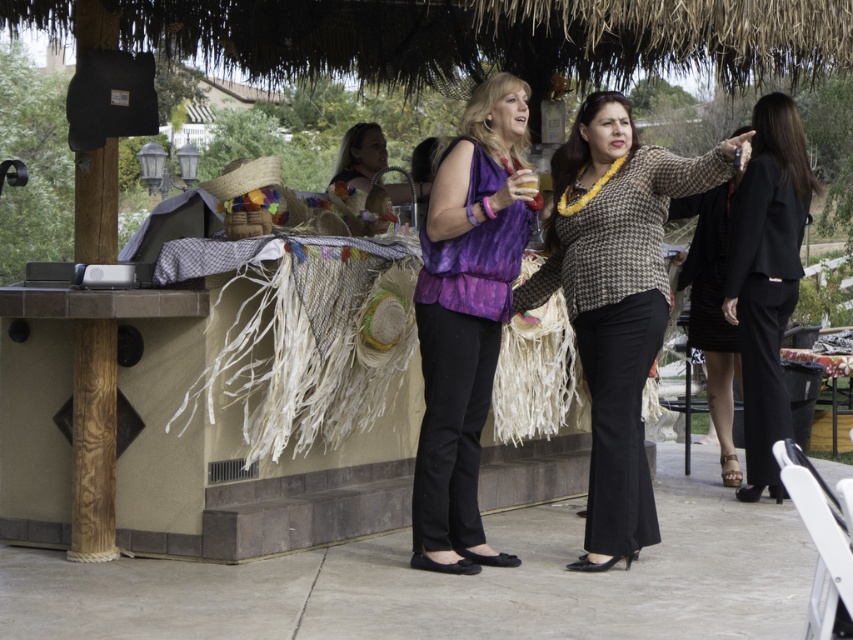
You are organizing a photoshoot and need to place a large prop between the purple silky blouse at center and the black matte suit at right. Which object should the prop be placed closer to if the prop is 1.2 meters wide?

The purple silky blouse at center is smaller than the black matte suit at right, so the prop should be placed closer to the black matte suit at right to accommodate its larger size.